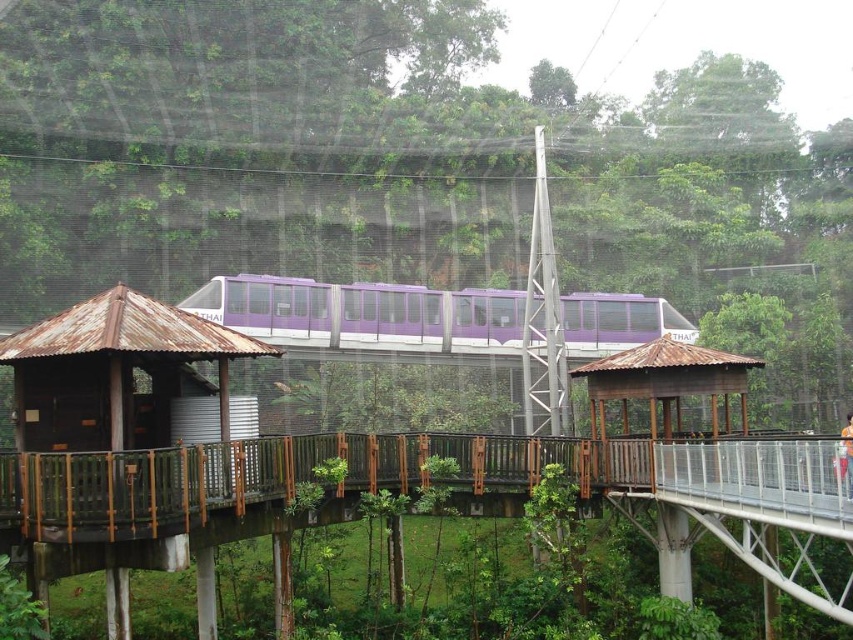
Is point (178, 525) less distant than point (437, 342)?

Yes, point (178, 525) is closer to viewer.

This screenshot has width=853, height=640. What do you see at coordinates (447, 483) in the screenshot?
I see `wooden at center` at bounding box center [447, 483].

Locate an element on the screen. wooden at center is located at coordinates (447, 483).

The width and height of the screenshot is (853, 640). What do you see at coordinates (113, 371) in the screenshot?
I see `rusty wood hut at left` at bounding box center [113, 371].

Is point (122, 353) farther from viewer compared to point (480, 317)?

No, it is not.

Where is `rusty wood hut at left`? This screenshot has width=853, height=640. rusty wood hut at left is located at coordinates (113, 371).

Does point (28, 477) come closer to viewer compared to point (660, 360)?

Yes.

Is wooden at center to the right of brown wooden gazebo at center from the viewer's perspective?

No, wooden at center is not to the right of brown wooden gazebo at center.

Who is more distant from viewer, (506, 436) or (671, 360)?

The point (506, 436) is behind.

Find the location of a particular element. The image size is (853, 640). wooden at center is located at coordinates (447, 483).